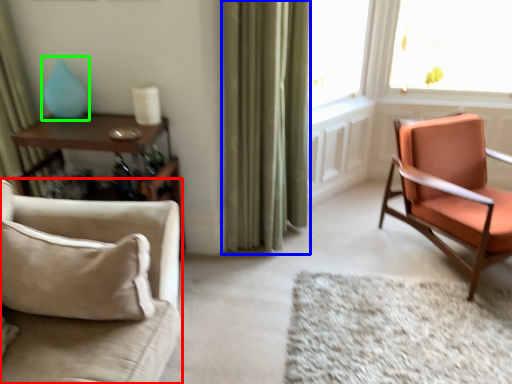
Question: Considering the real-world distances, which object is farthest from chair (highlighted by a red box)? curtain (highlighted by a blue box) or turquoise (highlighted by a green box)?

Choices:
 (A) curtain
 (B) turquoise

Answer: (A)